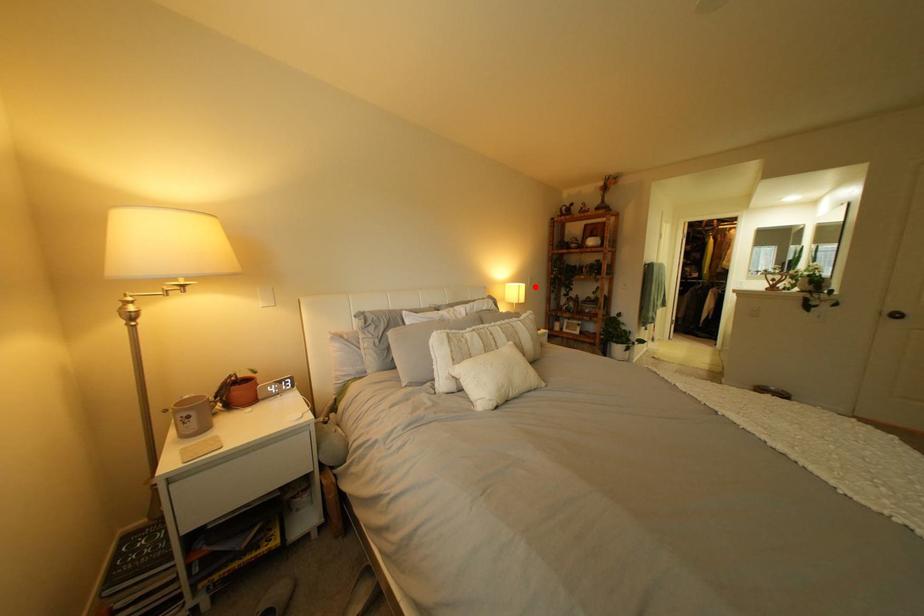
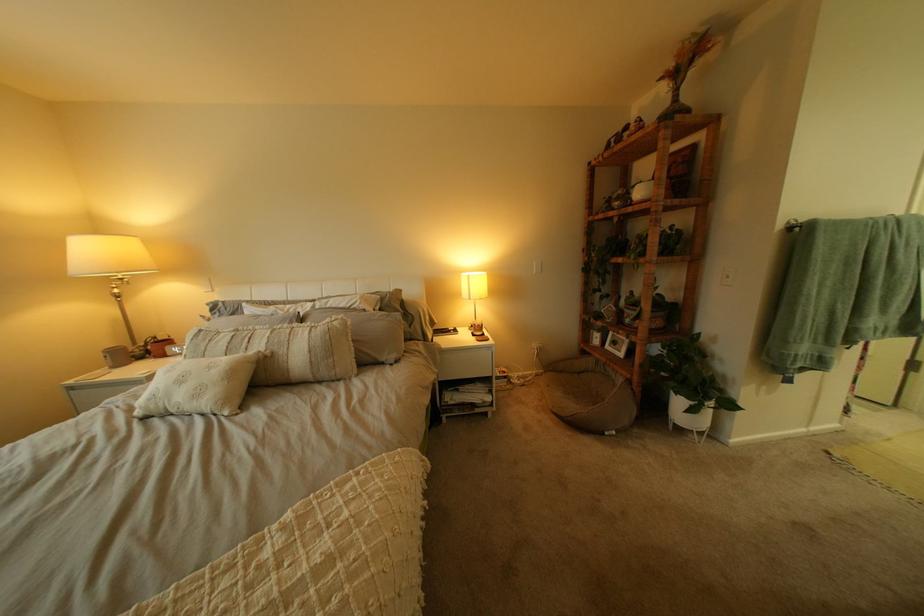
Locate, in the second image, the point that corresponds to the highlighted location in the first image.

(483, 277)